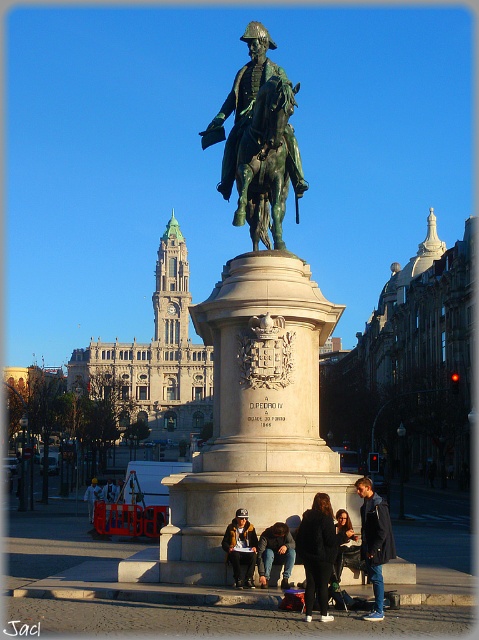
You are a photographer trying to capture a candid shot of the people around the statue. You notice two individuals wearing dark blue jeans at lower center and light blue denim jacket at lower center. Which clothing item is positioned to the right of the other?

The dark blue jeans at lower center are positioned to the right of the light blue denim jacket at lower center.

You are standing in the public square and want to take a photo of the green patina statue at center. If your camera can focus on objects up to 40 meters away, will you need to move closer to get a clear shot?

The green patina statue at center is 41.80 meters from viewer, which is beyond the camera focus range of 40 meters. You need to move closer to get a clear shot.

You are a tour guide leading a group to the statue. A tourist asks if they can touch the statue. You know that the black leather jacket at lower center is 38.67 meters away from the statue. Can they safely approach without getting too close to the statue?

The black leather jacket at lower center is 38.67 meters away from the statue. Since the jacket is far away, the tourist can safely approach the statue as long as they maintain a safe distance from it.